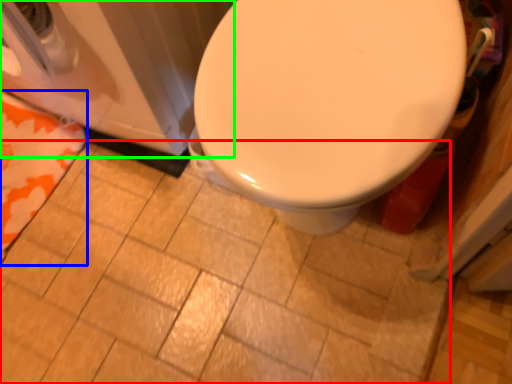
Question: Which is farther away from ceramic tile (highlighted by a red box)? beach towel (highlighted by a blue box) or washer (highlighted by a green box)?

Choices:
 (A) beach towel
 (B) washer

Answer: (B)